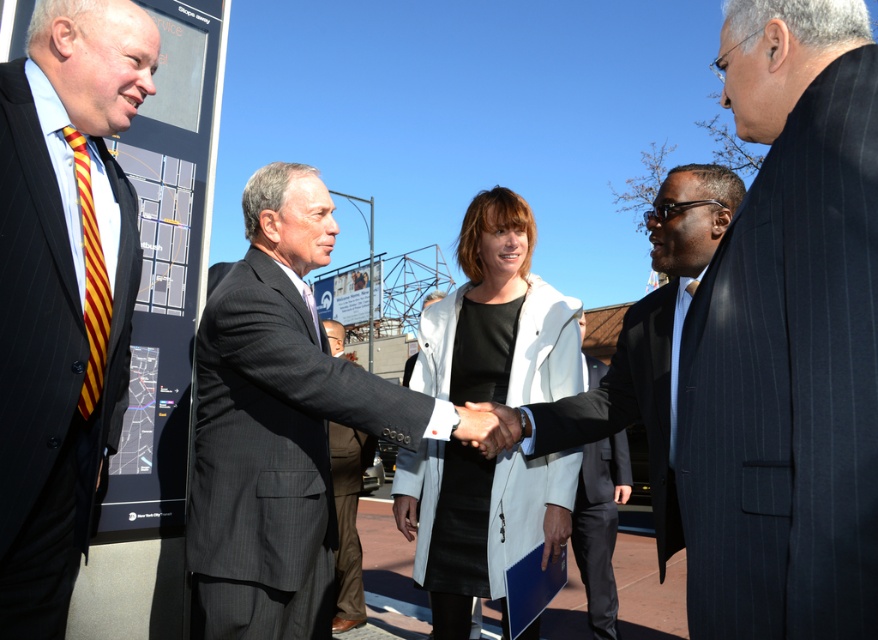
Question: Can you confirm if striped tie at left is wider than white matte coat at center?

Choices:
 (A) yes
 (B) no

Answer: (B)

Question: Does striped tie at left have a greater width compared to black leather hand at center?

Choices:
 (A) yes
 (B) no

Answer: (A)

Question: Does black smooth suit at center have a lesser width compared to dark brown suit at center?

Choices:
 (A) yes
 (B) no

Answer: (A)

Question: Which of the following is the closest to the observer?

Choices:
 (A) (684, 234)
 (B) (502, 432)
 (C) (426, 312)

Answer: (B)

Question: Considering the real-world distances, which object is closest to the dark gray suit at center?

Choices:
 (A) dark brown suit at center
 (B) dark blue pinstripe suit at center
 (C) striped tie at left
 (D) black smooth suit at center

Answer: (C)

Question: Which of these objects is positioned closest to the black smooth suit at center?

Choices:
 (A) black pinstripe suit at center
 (B) dark brown suit at center
 (C) striped tie at left
 (D) white matte coat at center

Answer: (D)